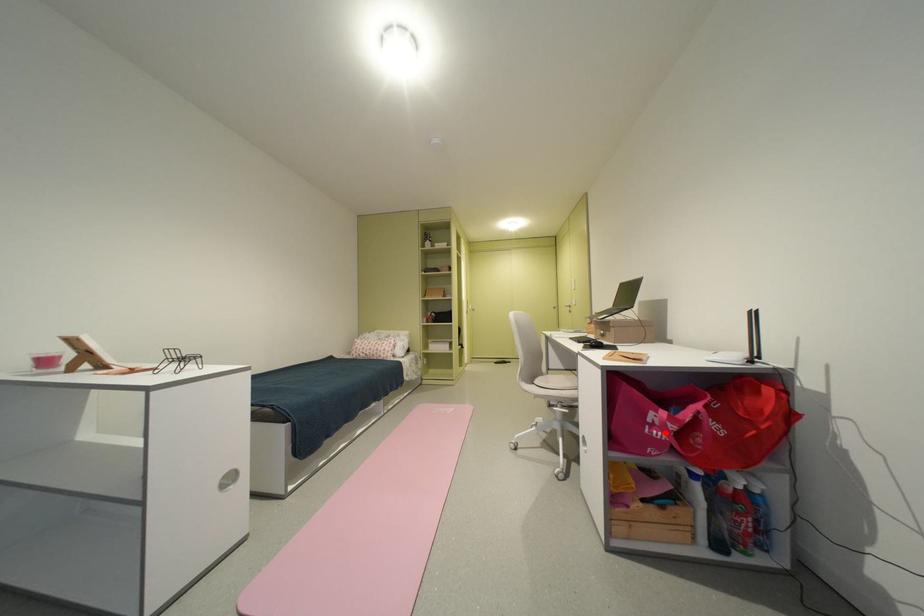
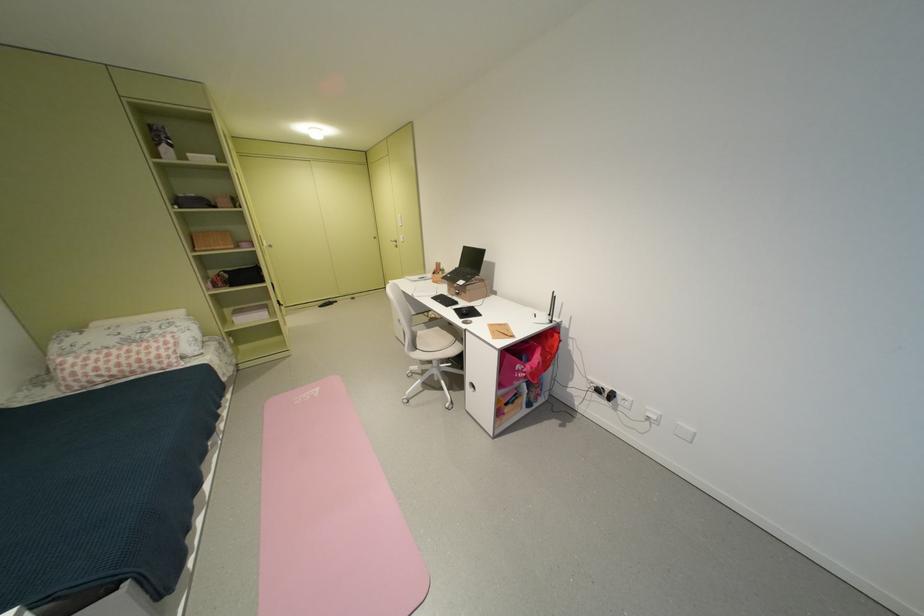
Question: I am providing you with two images of the same scene from different viewpoints. Given a red point in image1, look at the same physical point in image2. Is it:

Choices:
 (A) Closer to the viewpoint
 (B) Farther from the viewpoint

Answer: (B)